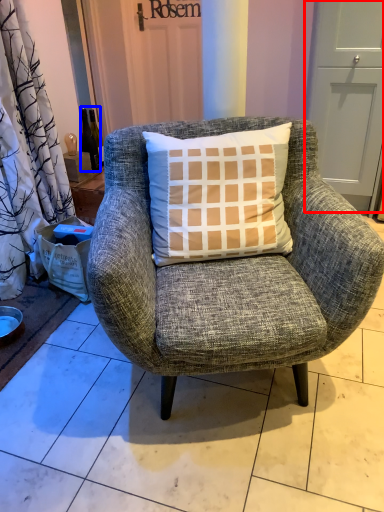
Question: Which object is closer to the camera taking this photo, screen door (highlighted by a red box) or bottle (highlighted by a blue box)?

Choices:
 (A) screen door
 (B) bottle

Answer: (A)